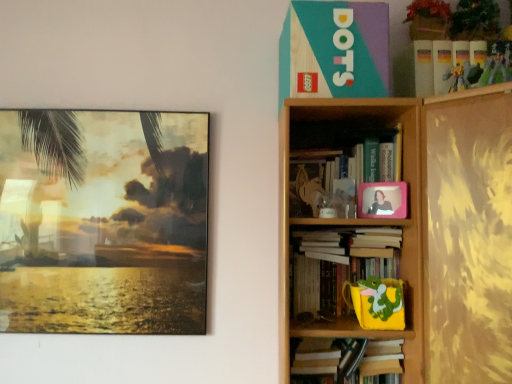
The image size is (512, 384). Identify the location of free space above pink plastic frame at upper right, the 3th book when ordered from bottom to top (from a real-world perspective). (341, 135).